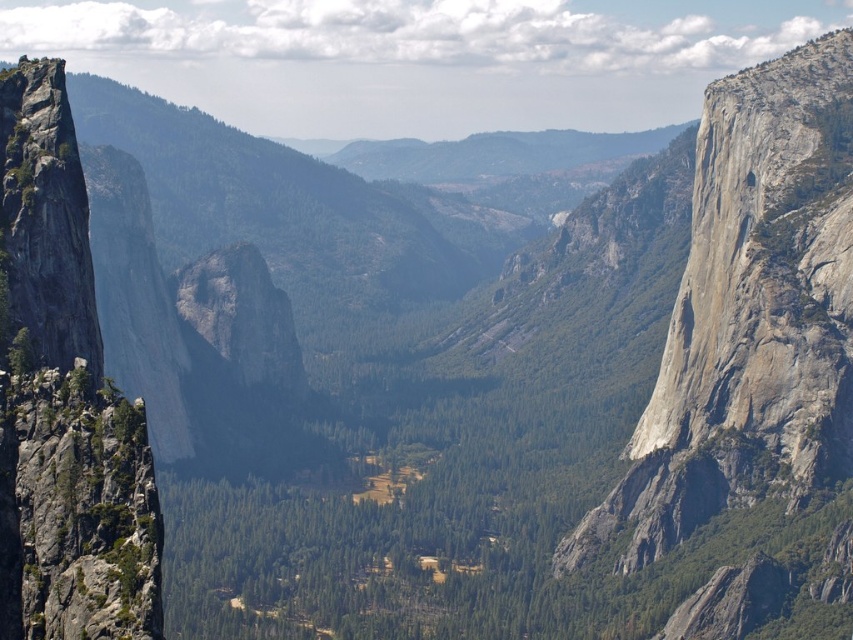
Which is above, gray/rough rock at right or gray/rough rock formation at left?

gray/rough rock at right is above.

Describe the element at coordinates (749, 320) in the screenshot. I see `gray/rough rock at right` at that location.

Where is `gray/rough rock at right`? gray/rough rock at right is located at coordinates (749, 320).